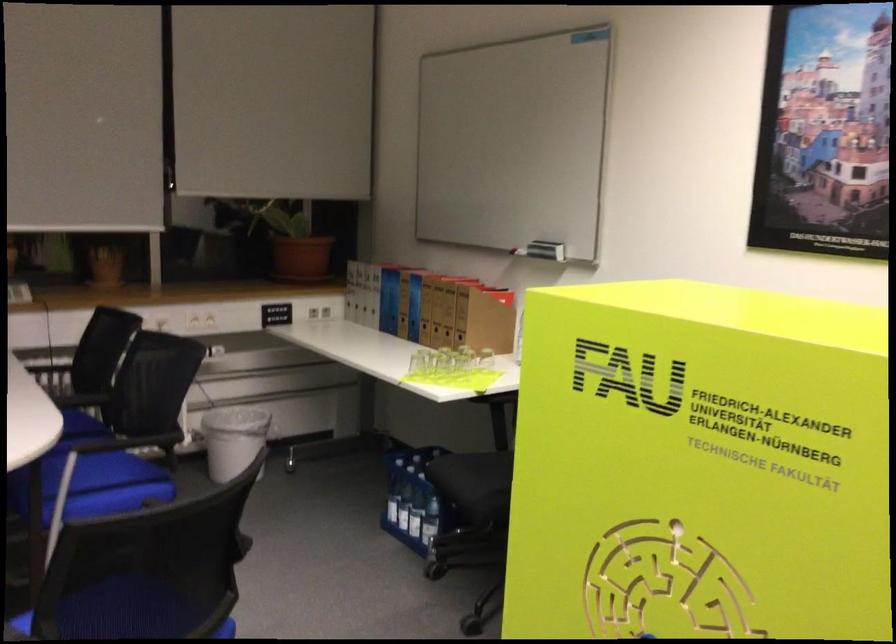
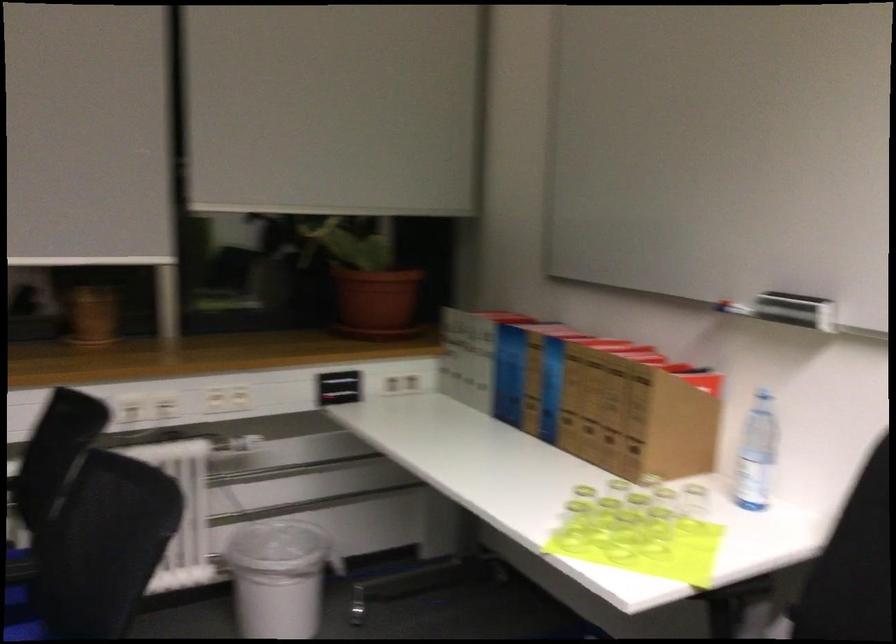
Find the pixel in the second image that matches point 302,257 in the first image.

(375, 303)